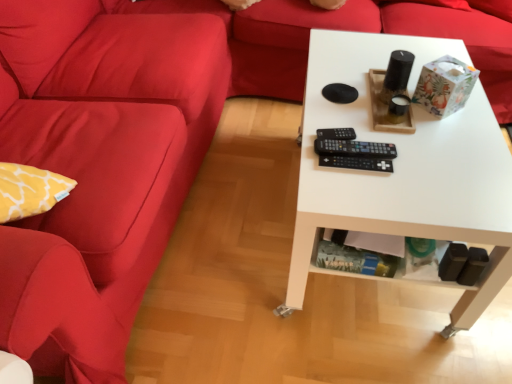
Where is `vacant space in front of black plastic remote at center, which is counted as the third control, starting from the top`? This screenshot has height=384, width=512. vacant space in front of black plastic remote at center, which is counted as the third control, starting from the top is located at coordinates (364, 194).